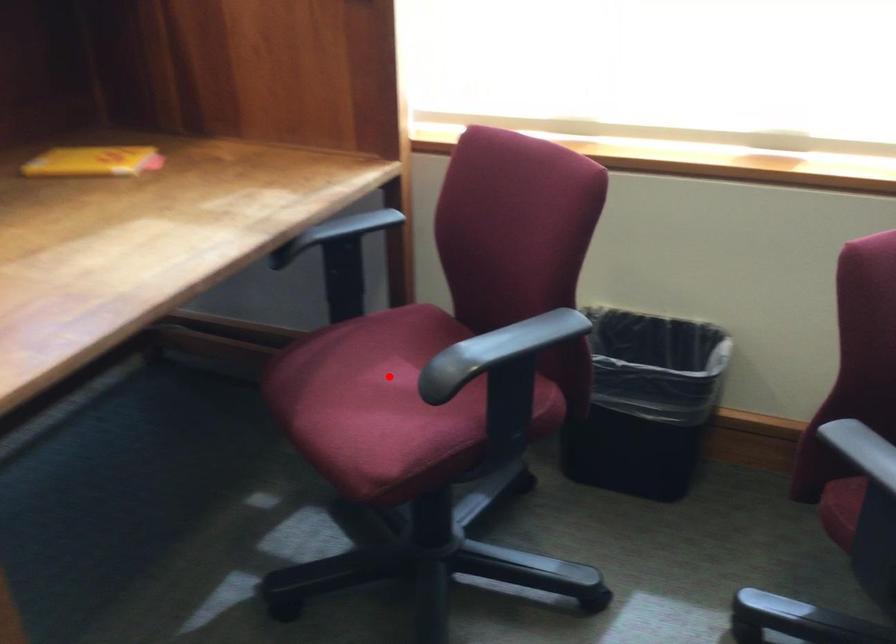
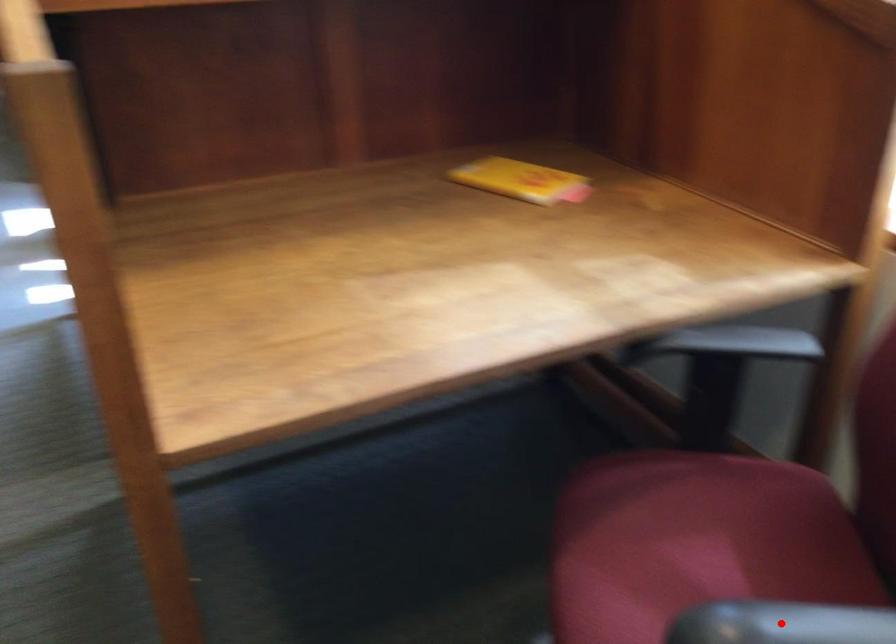
I am providing you with two images of the same scene from different viewpoints. A red point is marked on the first image and another point is marked on the second image. Do the highlighted points in image1 and image2 indicate the same real-world spot?

No